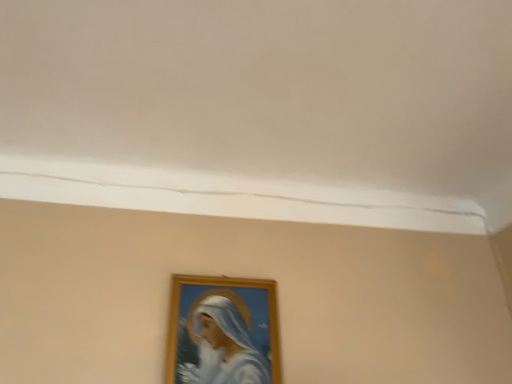
The image size is (512, 384). I want to click on wooden picture frame at center, so click(223, 331).

What do you see at coordinates (223, 331) in the screenshot? I see `wooden picture frame at center` at bounding box center [223, 331].

In order to face wooden picture frame at center, should I rotate leftwards or rightwards?

Rotate left and turn 4.105 degrees.

Measure the distance between point (218, 342) and camera.

The distance of point (218, 342) from camera is 92.10 centimeters.

This screenshot has width=512, height=384. Find the location of `wooden picture frame at center`. wooden picture frame at center is located at coordinates (223, 331).